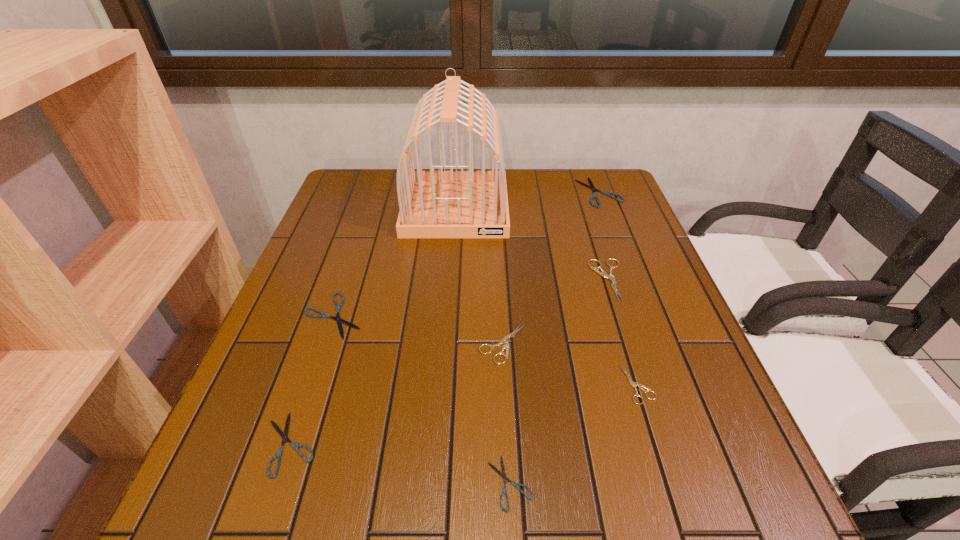
Find the location of a particular element. The image size is (960, 540). the tallest object is located at coordinates (433, 204).

Identify the location of birdcage. Image resolution: width=960 pixels, height=540 pixels. (433, 204).

Where is `the seventh shortest object`? This screenshot has height=540, width=960. the seventh shortest object is located at coordinates (595, 269).

Where is `the farthest beige shears`? The height and width of the screenshot is (540, 960). the farthest beige shears is located at coordinates (595, 269).

I want to click on the farthest shears, so click(591, 186).

This screenshot has width=960, height=540. I want to click on the farthest black shears, so click(x=591, y=186).

The image size is (960, 540). In order to click on the second biggest beige shears in this screenshot , I will do `click(504, 341)`.

Image resolution: width=960 pixels, height=540 pixels. Find the location of `the second nearest beige shears`. the second nearest beige shears is located at coordinates (504, 341).

The height and width of the screenshot is (540, 960). In order to click on the second farthest black shears in this screenshot , I will do click(323, 315).

This screenshot has height=540, width=960. I want to click on the smallest beige shears, so click(632, 383).